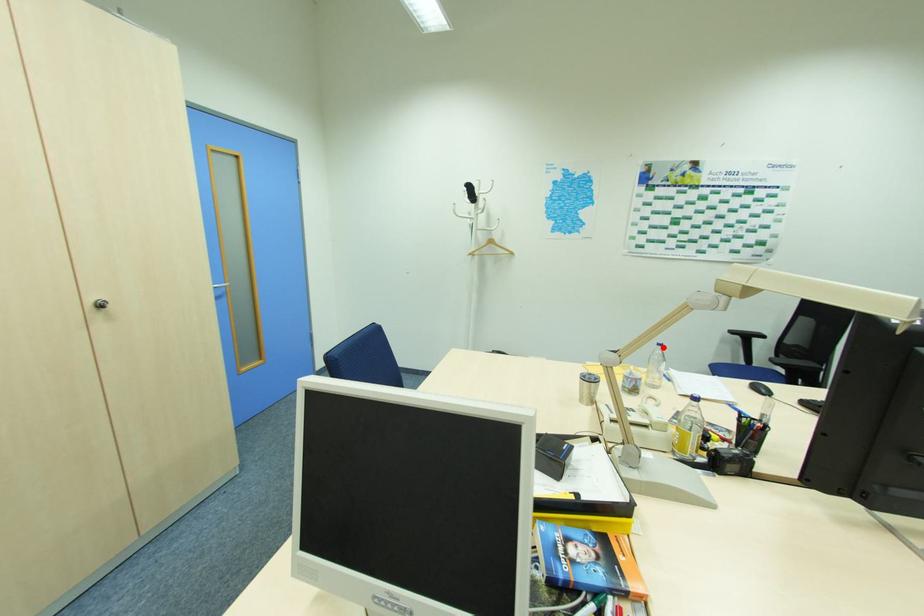
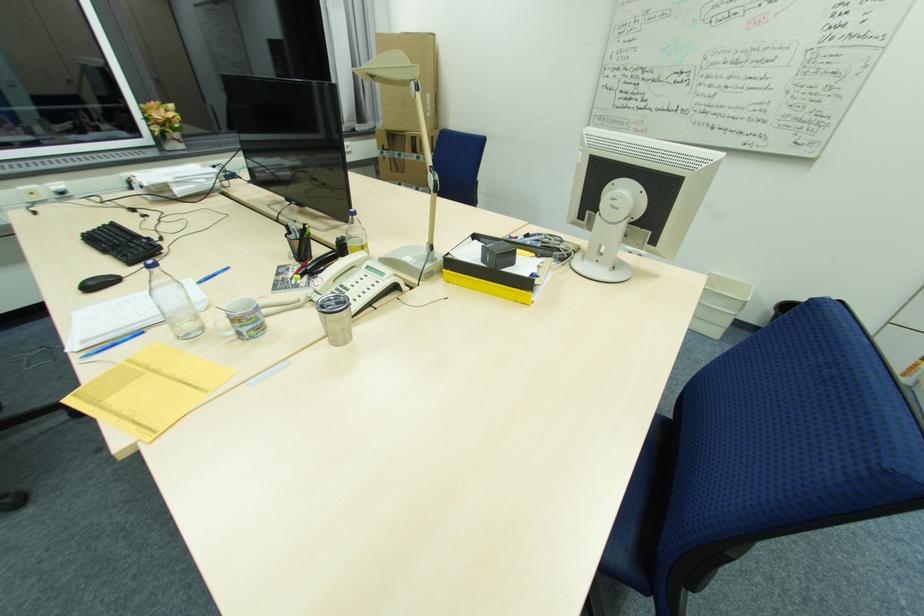
In the second image, find the point that corresponds to the highlighted location in the first image.

(157, 270)